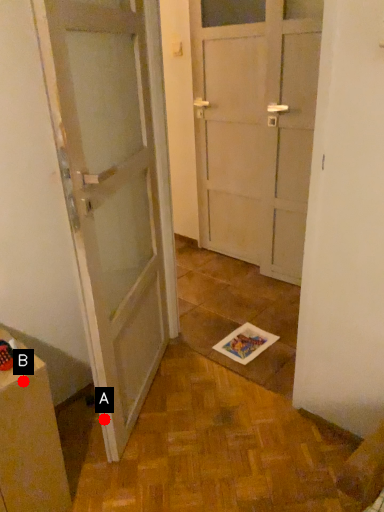
Question: Two points are circled on the image, labeled by A and B beside each circle. Which of the following is the closest to the observer?

Choices:
 (A) A is closer
 (B) B is closer

Answer: (B)